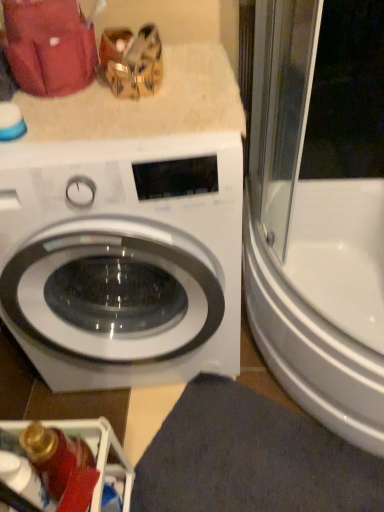
The height and width of the screenshot is (512, 384). Describe the element at coordinates (311, 244) in the screenshot. I see `white glossy bathtub at right` at that location.

I want to click on dark gray fabric bath mat at lower center, so [250, 458].

The image size is (384, 512). Find the location of `white glossy washing machine at center`. white glossy washing machine at center is located at coordinates (123, 259).

Considering the positions of objects dark gray fabric bath mat at lower center and white glossy bathtub at right in the image provided, who is more to the right, dark gray fabric bath mat at lower center or white glossy bathtub at right?

Positioned to the right is white glossy bathtub at right.

Which is less distant, (330, 458) or (260, 319)?

Point (330, 458) is positioned closer to the camera compared to point (260, 319).

Considering the relative sizes of dark gray fabric bath mat at lower center and white glossy bathtub at right in the image provided, is dark gray fabric bath mat at lower center smaller than white glossy bathtub at right?

Yes.

Is dark gray fabric bath mat at lower center taller or shorter than white glossy bathtub at right?

Considering their sizes, dark gray fabric bath mat at lower center has less height than white glossy bathtub at right.

Is metallic silver dishwasher at lower left inside white glossy washing machine at center?

That's incorrect, metallic silver dishwasher at lower left is not inside white glossy washing machine at center.

Can you confirm if white glossy washing machine at center is wider than metallic silver dishwasher at lower left?

Yes, white glossy washing machine at center is wider than metallic silver dishwasher at lower left.

Between white glossy washing machine at center and metallic silver dishwasher at lower left, which one appears on the left side from the viewer's perspective?

metallic silver dishwasher at lower left.

In terms of height, does white glossy washing machine at center look taller or shorter compared to dark gray fabric bath mat at lower center?

In the image, white glossy washing machine at center appears to be taller than dark gray fabric bath mat at lower center.

Can you tell me how much white glossy washing machine at center and dark gray fabric bath mat at lower center differ in facing direction?

There is a 30.4-degree angle between the facing directions of white glossy washing machine at center and dark gray fabric bath mat at lower center.

Looking at this image, considering the sizes of objects white glossy washing machine at center and dark gray fabric bath mat at lower center in the image provided, who is thinner, white glossy washing machine at center or dark gray fabric bath mat at lower center?

With smaller width is dark gray fabric bath mat at lower center.

Measure the distance from white glossy washing machine at center to dark gray fabric bath mat at lower center.

white glossy washing machine at center is 15.10 inches from dark gray fabric bath mat at lower center.

Can we say white glossy washing machine at center lies outside white glossy bathtub at right?

Yes, white glossy washing machine at center is located beyond the bounds of white glossy bathtub at right.

In the scene shown: From the image's perspective, relative to white glossy bathtub at right, is white glossy washing machine at center above or below?

Based on their image positions, white glossy washing machine at center is located above white glossy bathtub at right.

Which object is further away from the camera taking this photo, white glossy washing machine at center or white glossy bathtub at right?

white glossy bathtub at right is further from the camera.

Between white glossy washing machine at center and white glossy bathtub at right, which one has larger size?

white glossy washing machine at center.

Which object is thinner, white glossy bathtub at right or dark gray fabric bath mat at lower center?

dark gray fabric bath mat at lower center.

Relative to dark gray fabric bath mat at lower center, is white glossy bathtub at right in front or behind?

white glossy bathtub at right is in front of dark gray fabric bath mat at lower center.

Where is `bath mat on the left side of white glossy bathtub at right`? The width and height of the screenshot is (384, 512). bath mat on the left side of white glossy bathtub at right is located at coordinates (250, 458).

Is metallic silver dishwasher at lower left directly adjacent to white glossy bathtub at right?

metallic silver dishwasher at lower left and white glossy bathtub at right are clearly separated.

How far apart are metallic silver dishwasher at lower left and white glossy bathtub at right?

metallic silver dishwasher at lower left is 27.17 inches from white glossy bathtub at right.

Is metallic silver dishwasher at lower left facing towards white glossy bathtub at right?

No, metallic silver dishwasher at lower left does not turn towards white glossy bathtub at right.

The image size is (384, 512). Find the location of `dish washer positioned vertically above the dark gray fabric bath mat at lower center (from a real-world perspective)`. dish washer positioned vertically above the dark gray fabric bath mat at lower center (from a real-world perspective) is located at coordinates (62, 467).

From a real-world perspective, between metallic silver dishwasher at lower left and dark gray fabric bath mat at lower center, who is vertically lower?

In real-world perspective, dark gray fabric bath mat at lower center is lower.

Considering their positions, is metallic silver dishwasher at lower left located in front of or behind dark gray fabric bath mat at lower center?

Clearly, metallic silver dishwasher at lower left is in front of dark gray fabric bath mat at lower center.

At what (x,y) coordinates should I click in order to perform the action: click on bath mat on the left of white glossy bathtub at right. Please return your answer as a coordinate pair (x, y). The image size is (384, 512). Looking at the image, I should click on (250, 458).

In the image, there is a white glossy washing machine at center. What are the coordinates of `dish washer below it (from a real-world perspective)` in the screenshot? It's located at (62, 467).

Which object lies nearer to the anchor point white glossy washing machine at center, metallic silver dishwasher at lower left or dark gray fabric bath mat at lower center?

metallic silver dishwasher at lower left is positioned closer to the anchor white glossy washing machine at center.

Estimate the real-world distances between objects in this image. Which object is further from metallic silver dishwasher at lower left, white glossy bathtub at right or white glossy washing machine at center?

The object further to metallic silver dishwasher at lower left is white glossy bathtub at right.

Looking at the image, which one is located further to dark gray fabric bath mat at lower center, white glossy bathtub at right or metallic silver dishwasher at lower left?

white glossy bathtub at right is positioned further to the anchor dark gray fabric bath mat at lower center.

When comparing their distances from white glossy bathtub at right, does white glossy washing machine at center or metallic silver dishwasher at lower left seem closer?

white glossy washing machine at center.

Looking at this image, looking at the image, which one is located closer to white glossy washing machine at center, dark gray fabric bath mat at lower center or white glossy bathtub at right?

white glossy bathtub at right is closer to white glossy washing machine at center.

When comparing their distances from white glossy bathtub at right, does white glossy washing machine at center or dark gray fabric bath mat at lower center seem further?

dark gray fabric bath mat at lower center.

From the image, which object appears to be nearer to dark gray fabric bath mat at lower center, white glossy washing machine at center or white glossy bathtub at right?

white glossy bathtub at right is positioned closer to the anchor dark gray fabric bath mat at lower center.

Which object lies nearer to the anchor point white glossy washing machine at center, white glossy bathtub at right or dark gray fabric bath mat at lower center?

white glossy bathtub at right is positioned closer to the anchor white glossy washing machine at center.

Locate an element on the screen. This screenshot has width=384, height=512. washing machine situated between metallic silver dishwasher at lower left and white glossy bathtub at right from left to right is located at coordinates (123, 259).

Where is `screen door that lies between white glossy washing machine at center and dark gray fabric bath mat at lower center from top to bottom`? Image resolution: width=384 pixels, height=512 pixels. screen door that lies between white glossy washing machine at center and dark gray fabric bath mat at lower center from top to bottom is located at coordinates (311, 244).

In order to click on dish washer between white glossy washing machine at center and dark gray fabric bath mat at lower center vertically in this screenshot , I will do `click(62, 467)`.

Find the location of `bath mat between metallic silver dishwasher at lower left and white glossy bathtub at right from left to right`. bath mat between metallic silver dishwasher at lower left and white glossy bathtub at right from left to right is located at coordinates (250, 458).